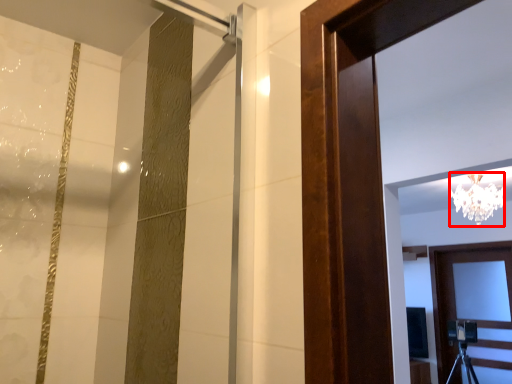
Question: From the image's perspective, considering the relative positions of lamp (annotated by the red box) and door in the image provided, where is lamp (annotated by the red box) located with respect to the staircase?

Choices:
 (A) below
 (B) above

Answer: (B)